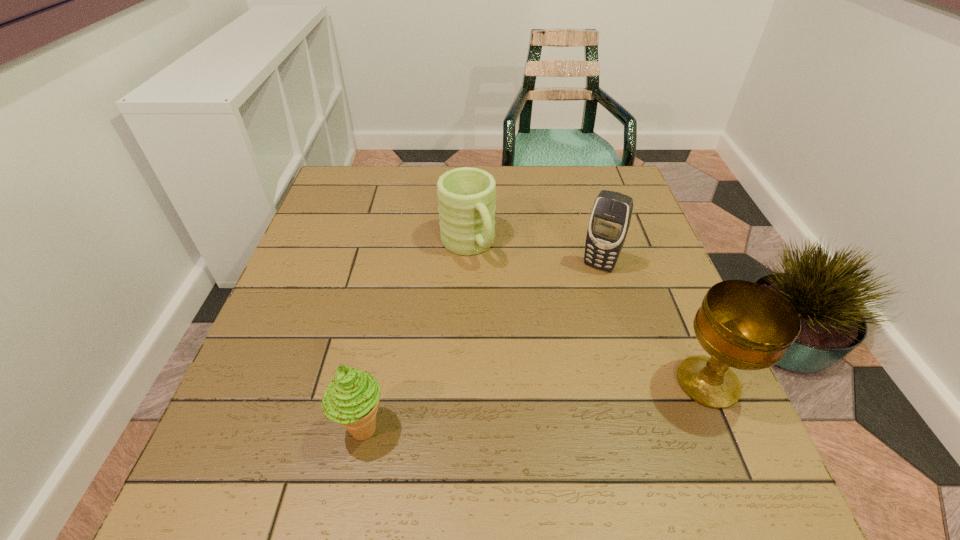
Locate an element on the screen. free space between the third object from right to left and the second object from right to left is located at coordinates (533, 255).

What are the coordinates of `free point between the second object from left to right and the rightmost object` in the screenshot? It's located at (588, 314).

Where is `unoccupied area between the rightmost object and the cellular telephone`? Image resolution: width=960 pixels, height=540 pixels. unoccupied area between the rightmost object and the cellular telephone is located at coordinates (654, 324).

Identify which object is the nearest to the chalice. Please provide its 2D coordinates. Your answer should be formatted as a tuple, i.e. [(x, y)], where the tuple contains the x and y coordinates of a point satisfying the conditions above.

[(609, 222)]

Identify the location of object that is the third closest one to the second object from right to left. This screenshot has height=540, width=960. [x=351, y=399].

Identify the location of free location that satisfies the following two spatial constraints: 1. on the front side of the cellular telephone; 2. on the left side of the mug. The height and width of the screenshot is (540, 960). (467, 266).

At what (x,y) coordinates should I click in order to perform the action: click on vacant region that satisfies the following two spatial constraints: 1. on the back side of the leftmost object; 2. on the right side of the mug. Please return your answer as a coordinate pair (x, y). Looking at the image, I should click on (400, 245).

The width and height of the screenshot is (960, 540). In order to click on vacant space that satisfies the following two spatial constraints: 1. on the back side of the icecream; 2. on the right side of the rightmost object in this screenshot , I will do `click(372, 382)`.